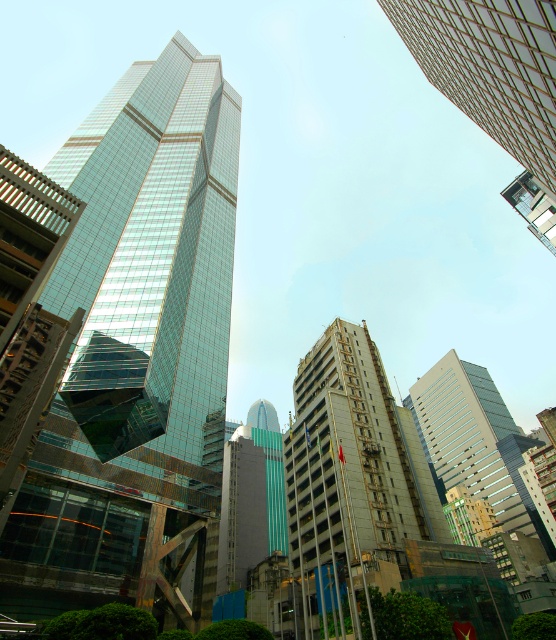
You are an architect analyzing the urban layout. Based on the scene, which of the two buildings, the transparent glass skyscraper at center or the matte glass building at center, is positioned higher in the vertical axis?

The transparent glass skyscraper at center is positioned higher in the vertical axis than the matte glass building at center because it is located above it.

You are a drone operator trying to fly a drone between the glassy reflective skyscraper at upper right and the matte glass building at center. Can you fly the drone through the space between them?

The glassy reflective skyscraper at upper right is in front of the matte glass building at center, so there is no space between them for the drone to fly through.

You are standing in the middle of the city looking at the skyscrapers. There are two points marked on the buildings. The first point is at coordinates point (354, 452) and the second is at point (429, 22). Which point appears closer to you?

Point (354, 452) is closer to the viewer than point (429, 22) because it is further to the viewer according to the description.